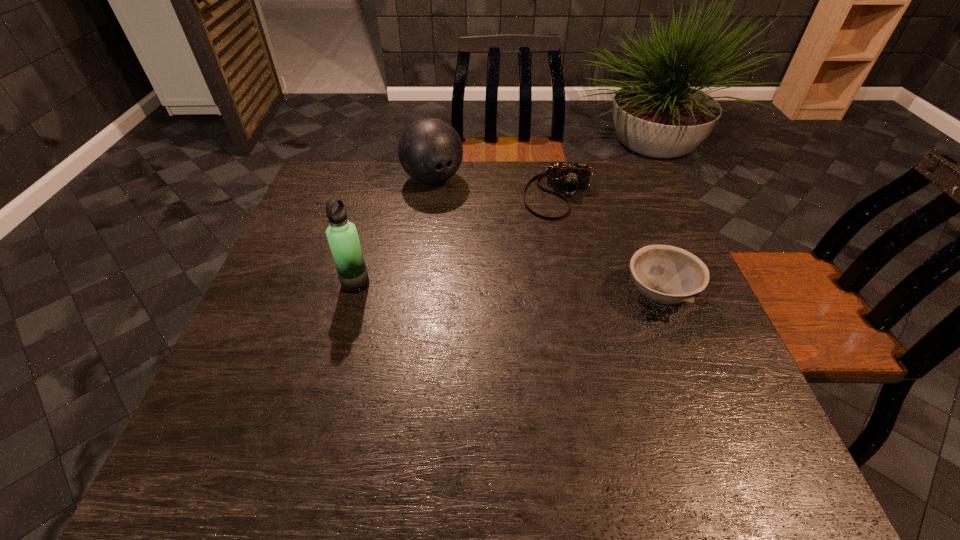
You are a GUI agent. You are given a task and a screenshot of the screen. Output one action in this format:
    pyautogui.click(x=<x>, y=<y>)
    Task: Click on the vacant area situated 0.080m on the grip area of the third object from right to left
    The image size is (960, 540).
    Given the screenshot: What is the action you would take?
    pyautogui.click(x=460, y=208)

Identify the location of free space located on the front-facing side of the camera. (555, 240).

Find the location of a particular element. This screenshot has width=960, height=540. vacant area located 0.240m on the front-facing side of the camera is located at coordinates (550, 280).

Locate an element on the screen. This screenshot has width=960, height=540. free location located 0.360m on the front-facing side of the camera is located at coordinates (546, 318).

Identify the location of bowling ball present at the far edge. The height and width of the screenshot is (540, 960). (430, 150).

Locate an element on the screen. This screenshot has width=960, height=540. camera located at the far edge is located at coordinates (571, 177).

What are the coordinates of `object that is at the right edge` in the screenshot? It's located at (668, 275).

Locate an element on the screen. This screenshot has height=540, width=960. free location at the far edge is located at coordinates (432, 193).

Locate an element on the screen. This screenshot has width=960, height=540. free space at the near edge of the desktop is located at coordinates (461, 410).

Locate an element on the screen. free region at the left edge is located at coordinates (298, 247).